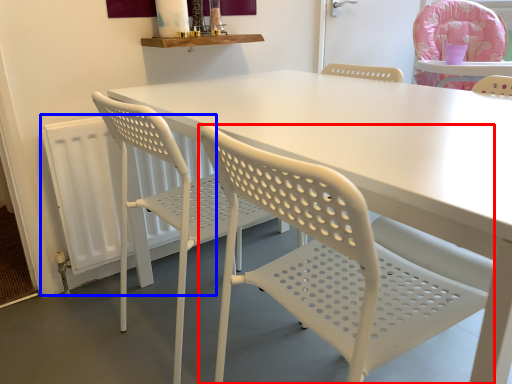
Question: Which object is further to the camera taking this photo, chair (highlighted by a red box) or radiator (highlighted by a blue box)?

Choices:
 (A) chair
 (B) radiator

Answer: (B)